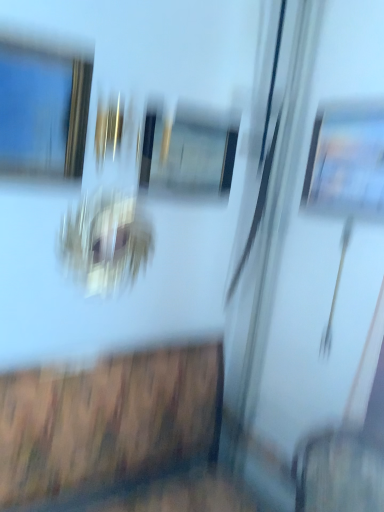
Find the location of a particular element. Image resolution: width=384 pixels, height=512 pixels. metallic gold frame at upper left is located at coordinates (43, 110).

This screenshot has width=384, height=512. What do you see at coordinates (43, 110) in the screenshot?
I see `metallic gold frame at upper left` at bounding box center [43, 110].

What do you see at coordinates (312, 261) in the screenshot?
I see `transparent glass screen door at center` at bounding box center [312, 261].

What are the coordinates of `transparent glass screen door at center` in the screenshot? It's located at (312, 261).

Where is `metallic gold frame at upper left`? Image resolution: width=384 pixels, height=512 pixels. metallic gold frame at upper left is located at coordinates [43, 110].

Can you confirm if metallic gold frame at upper left is positioned to the right of transparent glass screen door at center?

Incorrect, metallic gold frame at upper left is not on the right side of transparent glass screen door at center.

Is the depth of metallic gold frame at upper left less than that of transparent glass screen door at center?

Yes, metallic gold frame at upper left is closer to the camera.

Is point (35, 156) in front of point (366, 258)?

Yes, point (35, 156) is closer to viewer.

From the image's perspective, who appears lower, metallic gold frame at upper left or transparent glass screen door at center?

From the image's view, transparent glass screen door at center is below.

From a real-world perspective, is metallic gold frame at upper left below transparent glass screen door at center?

Incorrect, from a real-world perspective, metallic gold frame at upper left is higher than transparent glass screen door at center.

Is metallic gold frame at upper left wider or thinner than transparent glass screen door at center?

Clearly, metallic gold frame at upper left has more width compared to transparent glass screen door at center.

Which of these two, metallic gold frame at upper left or transparent glass screen door at center, stands taller?

transparent glass screen door at center.

Considering the relative sizes of metallic gold frame at upper left and transparent glass screen door at center in the image provided, is metallic gold frame at upper left smaller than transparent glass screen door at center?

Indeed, metallic gold frame at upper left has a smaller size compared to transparent glass screen door at center.

Is metallic gold frame at upper left completely or partially outside of transparent glass screen door at center?

Indeed, metallic gold frame at upper left is completely outside transparent glass screen door at center.

From the picture: Would you say metallic gold frame at upper left is a long distance from transparent glass screen door at center?

That's not correct — metallic gold frame at upper left is a little close to transparent glass screen door at center.

Is metallic gold frame at upper left facing towards transparent glass screen door at center?

→ No, metallic gold frame at upper left is not oriented towards transparent glass screen door at center.

How many degrees apart are the facing directions of metallic gold frame at upper left and transparent glass screen door at center?

The angular difference between metallic gold frame at upper left and transparent glass screen door at center is 90 degrees.

Measure the distance from metallic gold frame at upper left to transparent glass screen door at center.

metallic gold frame at upper left is 36.51 inches from transparent glass screen door at center.

Locate an element on the screen. The image size is (384, 512). screen door located below the metallic gold frame at upper left (from the image's perspective) is located at coordinates (312, 261).

Considering the relative positions of transparent glass screen door at center and metallic gold frame at upper left in the image provided, is transparent glass screen door at center to the right of metallic gold frame at upper left from the viewer's perspective?

Yes, transparent glass screen door at center is to the right of metallic gold frame at upper left.

Is transparent glass screen door at center behind metallic gold frame at upper left?

Yes, it is.

Which is in front, point (265, 27) or point (17, 95)?

Point (17, 95)

From the image's perspective, is transparent glass screen door at center positioned above or below metallic gold frame at upper left?

transparent glass screen door at center is below metallic gold frame at upper left.

From a real-world perspective, which is physically above, transparent glass screen door at center or metallic gold frame at upper left?

From a 3D spatial view, metallic gold frame at upper left is above.

Which object is wider, transparent glass screen door at center or metallic gold frame at upper left?

Wider between the two is metallic gold frame at upper left.

Does transparent glass screen door at center have a lesser height compared to metallic gold frame at upper left?

No, transparent glass screen door at center is not shorter than metallic gold frame at upper left.

Does transparent glass screen door at center have a smaller size compared to metallic gold frame at upper left?

No, transparent glass screen door at center is not smaller than metallic gold frame at upper left.

Is transparent glass screen door at center positioned beyond the bounds of metallic gold frame at upper left?

That's correct, transparent glass screen door at center is outside of metallic gold frame at upper left.

Is transparent glass screen door at center positioned far away from metallic gold frame at upper left?

No, transparent glass screen door at center is not far from metallic gold frame at upper left.

Is transparent glass screen door at center oriented towards metallic gold frame at upper left?

Yes, transparent glass screen door at center is oriented towards metallic gold frame at upper left.

How distant is transparent glass screen door at center from metallic gold frame at upper left?

transparent glass screen door at center and metallic gold frame at upper left are 36.51 inches apart.

What are the coordinates of `screen door lying below the metallic gold frame at upper left (from the image's perspective)` in the screenshot? It's located at (312, 261).

Where is `window located in front of the transparent glass screen door at center`? window located in front of the transparent glass screen door at center is located at coordinates (43, 110).

This screenshot has height=512, width=384. I want to click on screen door located behind the metallic gold frame at upper left, so click(x=312, y=261).